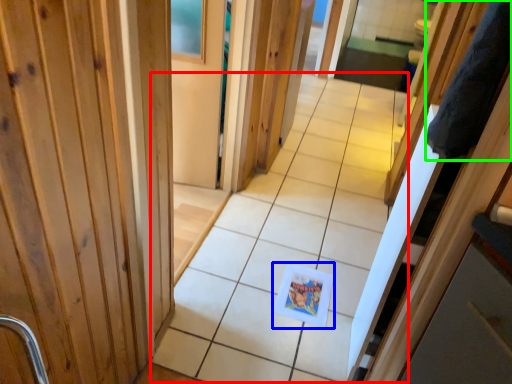
Question: Considering the real-world distances, which object is farthest from path (highlighted by a red box)? postcard (highlighted by a blue box) or robe (highlighted by a green box)?

Choices:
 (A) postcard
 (B) robe

Answer: (B)